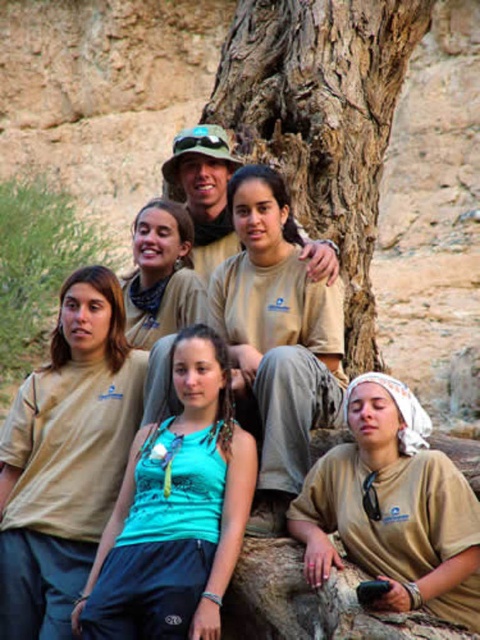
Is matte khaki t-shirt at center smaller than beige cotton shirt at center?

No.

Find the location of a particular element. The image size is (480, 640). matte khaki t-shirt at center is located at coordinates (66, 456).

Where is `matte khaki t-shirt at center`? This screenshot has height=640, width=480. matte khaki t-shirt at center is located at coordinates (66, 456).

Does point (274, 240) lie in front of point (152, 326)?

Yes, point (274, 240) is in front of point (152, 326).

Find the location of a particular element. The image size is (480, 640). beige cotton shirt at center is located at coordinates (276, 339).

You are a GUI agent. You are given a task and a screenshot of the screen. Output one action in this format:
    pyautogui.click(x=<x>, y=<y>)
    Task: Click on the beige cotton shirt at center
    The image size is (480, 640).
    Given the screenshot: What is the action you would take?
    pyautogui.click(x=276, y=339)

Between matte khaki t-shirt at center and matte khaki shirt at center, which one is positioned higher?

Positioned higher is matte khaki shirt at center.

From the picture: Which is below, matte khaki t-shirt at center or matte khaki shirt at center?

matte khaki t-shirt at center is below.

Identify the location of matte khaki t-shirt at center. This screenshot has height=640, width=480. (66, 456).